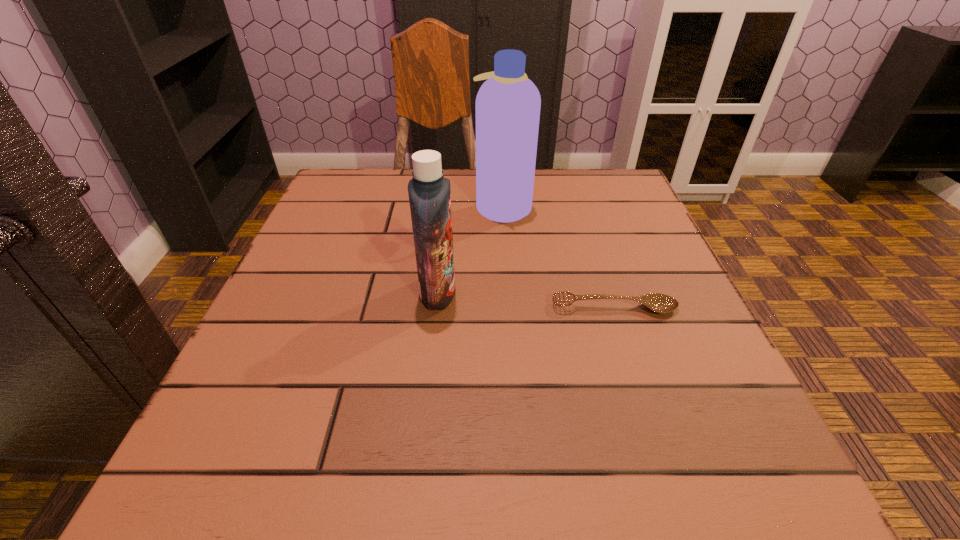
Identify the location of vacant space that is in between the leftmost object and the ladle. (526, 300).

Image resolution: width=960 pixels, height=540 pixels. I want to click on empty space that is in between the farthest object and the left shampoo, so click(470, 249).

Where is `vacant area that lies between the shorter shampoo and the right shampoo`? The height and width of the screenshot is (540, 960). vacant area that lies between the shorter shampoo and the right shampoo is located at coordinates (470, 249).

I want to click on free space between the nearer shampoo and the right shampoo, so click(470, 249).

The height and width of the screenshot is (540, 960). I want to click on vacant space that's between the tallest object and the leftmost object, so click(470, 249).

Where is `unoccupied position between the leftmost object and the ladle`? unoccupied position between the leftmost object and the ladle is located at coordinates (526, 300).

The height and width of the screenshot is (540, 960). Identify the location of empty space that is in between the second shortest object and the rightmost object. (526, 300).

Find the location of a particular element. Image resolution: width=960 pixels, height=540 pixels. free space between the tallest object and the shortest object is located at coordinates (559, 257).

Locate which object ranks in proximity to the shortest object. Please provide its 2D coordinates. Your answer should be formatted as a tuple, i.e. [(x, y)], where the tuple contains the x and y coordinates of a point satisfying the conditions above.

[(429, 192)]

What are the coordinates of `object that is the second closest to the rightmost object` in the screenshot? It's located at (508, 104).